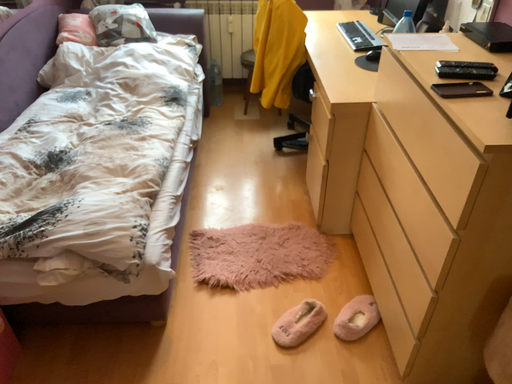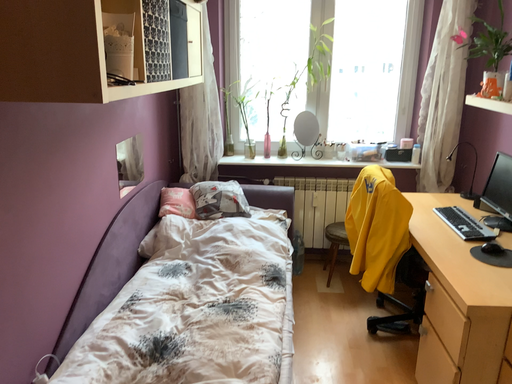
Question: How did the camera likely rotate when shooting the video?

Choices:
 (A) rotated downward
 (B) rotated upward

Answer: (B)